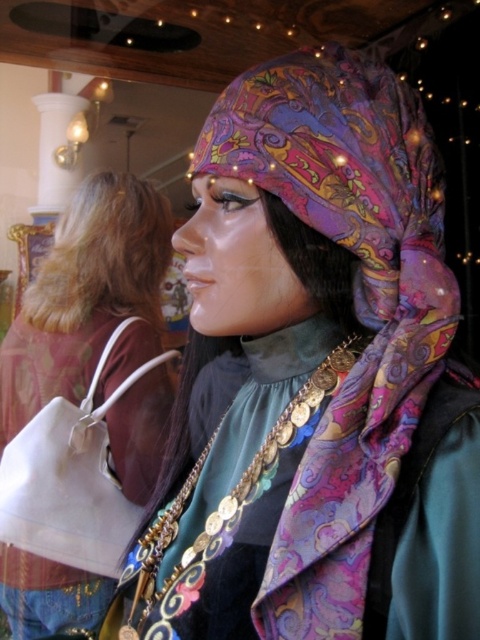
Is paisley-patterned scarf at center positioned behind matte white bag at left?

No, it is not.

This screenshot has width=480, height=640. Describe the element at coordinates (315, 376) in the screenshot. I see `paisley-patterned scarf at center` at that location.

Is point (248, 561) positioned after point (69, 612)?

No, it is in front of (69, 612).

Locate an element on the screen. The image size is (480, 640). paisley-patterned scarf at center is located at coordinates (315, 376).